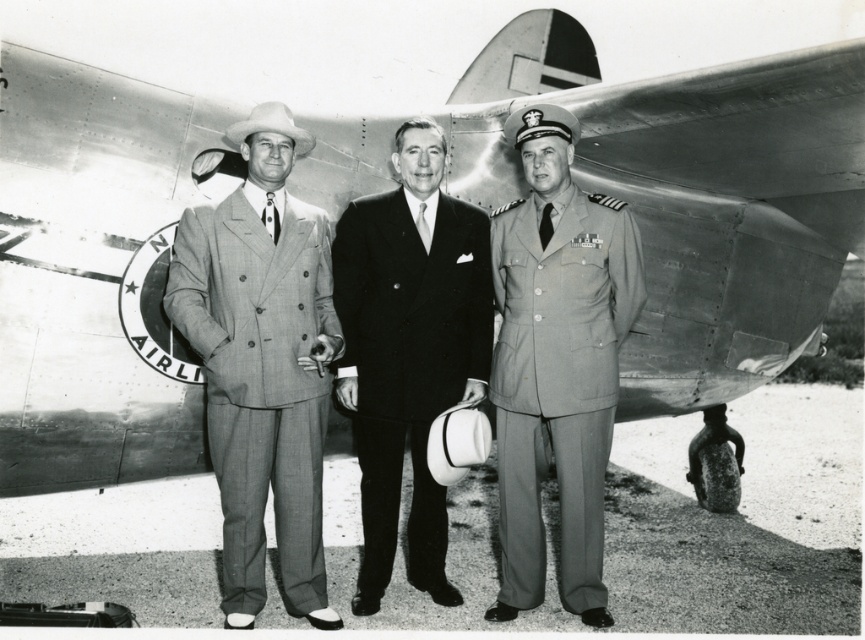
Question: Is matte gray uniform at center to the left of smooth black suit at center from the viewer's perspective?

Choices:
 (A) yes
 (B) no

Answer: (B)

Question: Which object is closer to the camera taking this photo?

Choices:
 (A) matte gray uniform at center
 (B) smooth black suit at center

Answer: (A)

Question: Which point is closer to the camera taking this photo?

Choices:
 (A) (521, 595)
 (B) (426, 401)

Answer: (B)

Question: Observing the image, what is the correct spatial positioning of plaid wool suit at center in reference to smooth black suit at center?

Choices:
 (A) below
 (B) above

Answer: (B)

Question: In this image, where is plaid wool suit at center located relative to matte gray uniform at center?

Choices:
 (A) above
 (B) below

Answer: (A)

Question: Which point is farther to the camera?

Choices:
 (A) smooth black suit at center
 (B) plaid wool suit at center
 (C) matte gray uniform at center

Answer: (A)